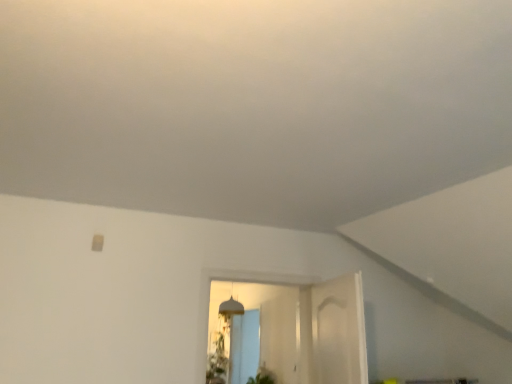
This screenshot has width=512, height=384. What do you see at coordinates (339, 331) in the screenshot?
I see `white matte door at center` at bounding box center [339, 331].

This screenshot has height=384, width=512. In order to click on white matte door at center in this screenshot , I will do `click(339, 331)`.

At what (x,y) coordinates should I click in order to perform the action: click on white matte door at center. Please return your answer as a coordinate pair (x, y). The width and height of the screenshot is (512, 384). Looking at the image, I should click on (339, 331).